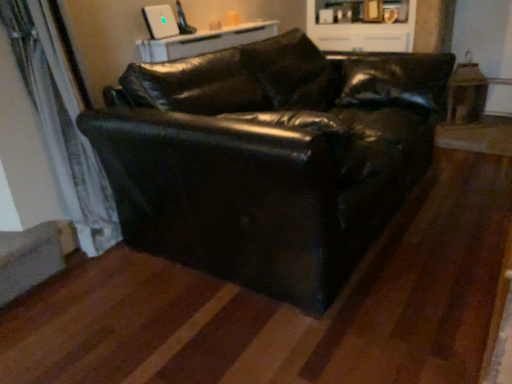
Question: From the image's perspective, is black leather couch at center above or below white glossy table at upper center?

Choices:
 (A) above
 (B) below

Answer: (B)

Question: Is black leather couch at center in front of or behind white glossy table at upper center in the image?

Choices:
 (A) behind
 (B) front

Answer: (B)

Question: Estimate the real-world distances between objects in this image. Which object is farther from the black leather couch at center?

Choices:
 (A) white glossy cabinet at upper center
 (B) white sheer curtain at left
 (C) white glossy table at upper center

Answer: (A)

Question: Which object is the farthest from the white glossy cabinet at upper center?

Choices:
 (A) white glossy table at upper center
 (B) black leather couch at center
 (C) white sheer curtain at left

Answer: (C)